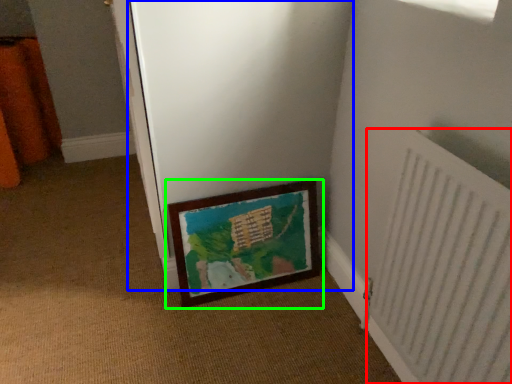
Question: Which object is the farthest from radiator (highlighted by a red box)? Choose among these: screen door (highlighted by a blue box) or picture frame (highlighted by a green box).

Choices:
 (A) screen door
 (B) picture frame

Answer: (A)